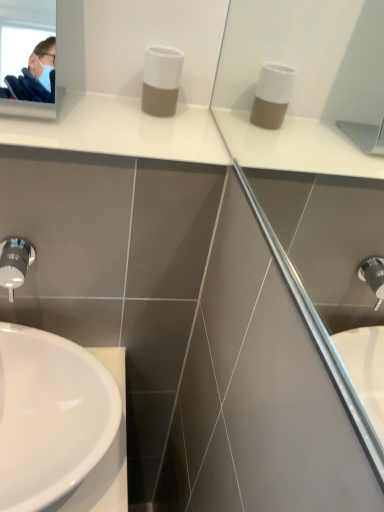
Question: From the image's perspective, is white glossy sink at lower left on top of white matte soap dispenser at center?

Choices:
 (A) yes
 (B) no

Answer: (B)

Question: Is white glossy sink at lower left taller than white matte soap dispenser at center?

Choices:
 (A) no
 (B) yes

Answer: (A)

Question: Is white glossy sink at lower left outside of white matte soap dispenser at center?

Choices:
 (A) yes
 (B) no

Answer: (A)

Question: Is white glossy sink at lower left in contact with white matte soap dispenser at center?

Choices:
 (A) yes
 (B) no

Answer: (B)

Question: Does white glossy sink at lower left appear on the right side of white matte soap dispenser at center?

Choices:
 (A) yes
 (B) no

Answer: (B)

Question: Can you confirm if white glossy sink at lower left is positioned to the left of white matte soap dispenser at center?

Choices:
 (A) yes
 (B) no

Answer: (A)

Question: From a real-world perspective, is satin nickel faucet at lower left under white matte soap dispenser at center?

Choices:
 (A) no
 (B) yes

Answer: (B)

Question: Is satin nickel faucet at lower left to the left of white matte soap dispenser at center from the viewer's perspective?

Choices:
 (A) no
 (B) yes

Answer: (B)

Question: Is satin nickel faucet at lower left further to the viewer compared to white matte soap dispenser at center?

Choices:
 (A) yes
 (B) no

Answer: (B)

Question: Is satin nickel faucet at lower left facing towards white matte soap dispenser at center?

Choices:
 (A) yes
 (B) no

Answer: (B)

Question: Is satin nickel faucet at lower left thinner than white matte soap dispenser at center?

Choices:
 (A) no
 (B) yes

Answer: (B)

Question: Can you confirm if satin nickel faucet at lower left is bigger than white matte soap dispenser at center?

Choices:
 (A) yes
 (B) no

Answer: (B)

Question: Would you say white matte soap dispenser at center is outside white glossy sink at lower left?

Choices:
 (A) no
 (B) yes

Answer: (B)